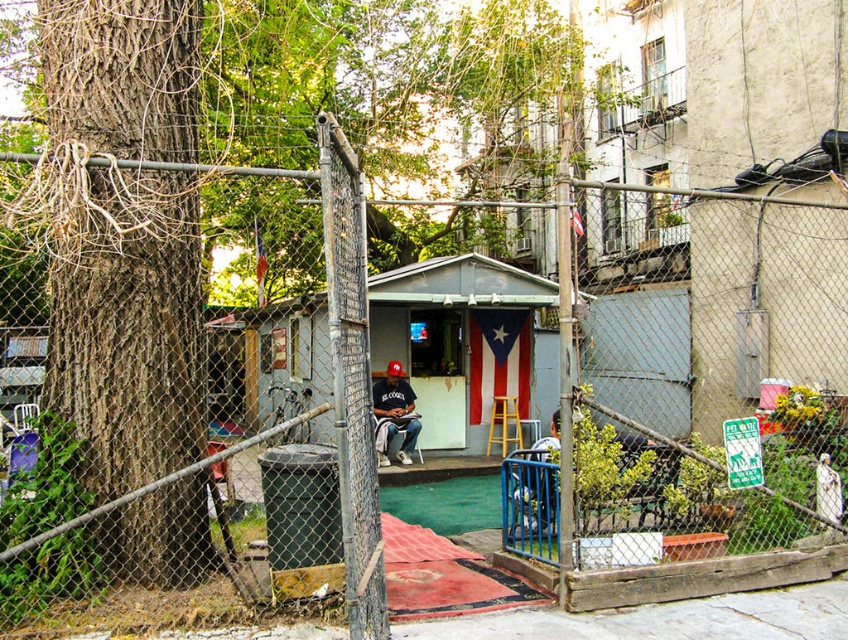
You are a delivery person standing at the entrance of the shed. You need to place a package that is 11 feet long between the brown rough bark tree at left and the matte black shirt at center. Is there enough space between them to fit the package?

The distance between the brown rough bark tree at left and the matte black shirt at center is 10.97 feet. Since the package is 11 feet long, it is slightly longer than the available space. Therefore, the package cannot be placed between them without overlapping.

You are a delivery person trying to deliver a package to the person wearing the matte black cap at center. The path to the cap is blocked by the brown rough bark tree at left. Can you go around the tree to reach the cap?

The brown rough bark tree at left is above the matte black cap at center, meaning the tree is positioned higher up in the image. However, this does not necessarily block the path. You can likely go around the tree to reach the matte black cap at center.